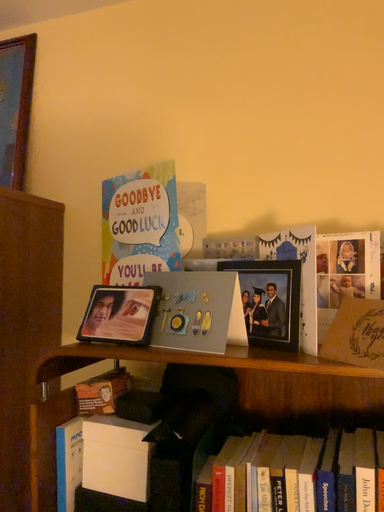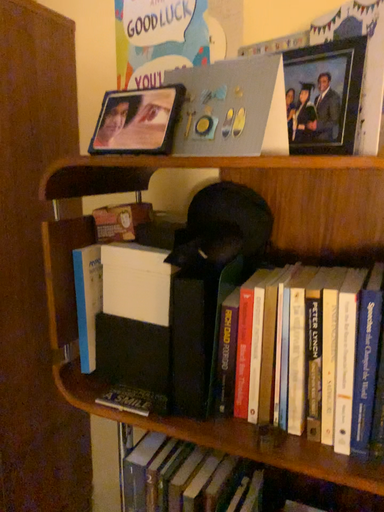
Question: How did the camera likely rotate when shooting the video?

Choices:
 (A) rotated upward
 (B) rotated downward

Answer: (B)